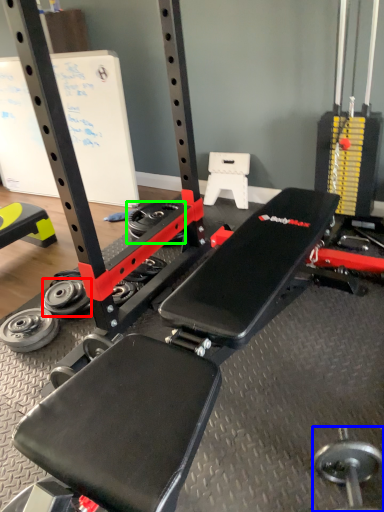
Question: Which object is positioned farthest from wheel (highlighted by a red box)? Select from dumbbell (highlighted by a blue box) and wheel (highlighted by a green box).

Choices:
 (A) dumbbell
 (B) wheel

Answer: (A)